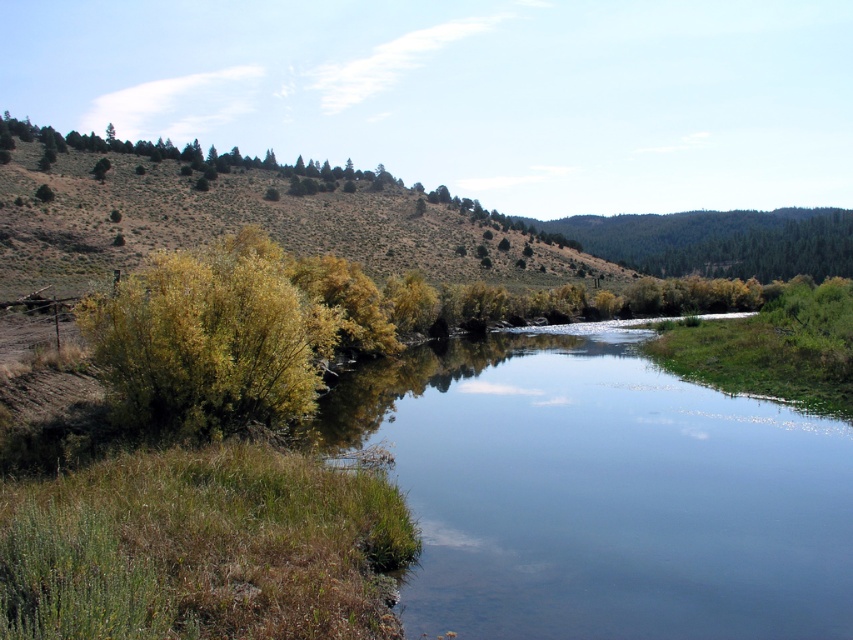
Question: Considering the real-world distances, which object is closest to the green shrubbery at upper left?

Choices:
 (A) green leafy bush at left
 (B) clear water at center

Answer: (A)

Question: Among these points, which one is nearest to the camera?

Choices:
 (A) (178, 243)
 (B) (555, 609)

Answer: (B)

Question: Is clear water at center behind green leafy bush at left?

Choices:
 (A) no
 (B) yes

Answer: (A)

Question: Can you confirm if clear water at center is positioned to the right of green leafy bush at left?

Choices:
 (A) no
 (B) yes

Answer: (B)

Question: Is green shrubbery at upper left bigger than green leafy bush at left?

Choices:
 (A) no
 (B) yes

Answer: (B)

Question: Which point is farther from the camera taking this photo?

Choices:
 (A) (595, 522)
 (B) (285, 208)
 (C) (193, 273)

Answer: (B)